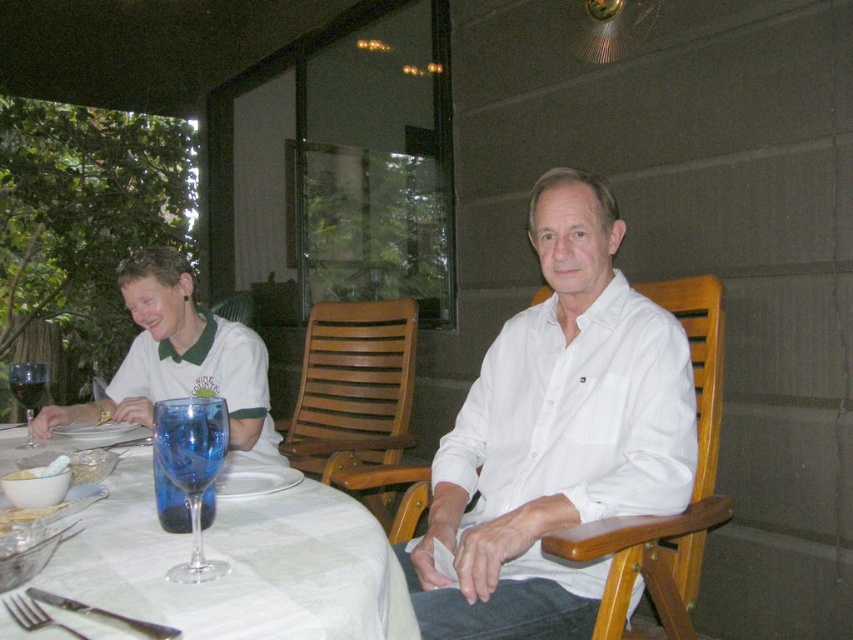
Can you confirm if white cotton shirt at upper center is thinner than white cotton shirt at center?

Yes.

Between white cotton shirt at upper center and white cotton shirt at center, which one appears on the right side from the viewer's perspective?

From the viewer's perspective, white cotton shirt at upper center appears more on the right side.

Is point (622, 355) less distant than point (579, 572)?

No.

This screenshot has width=853, height=640. I want to click on white cotton shirt at upper center, so click(556, 435).

Between light brown wooden chair at center and white cotton shirt at upper left, which one appears on the left side from the viewer's perspective?

white cotton shirt at upper left

Is light brown wooden chair at center thinner than white cotton shirt at upper left?

Correct, light brown wooden chair at center's width is less than white cotton shirt at upper left's.

At what (x,y) coordinates should I click in order to perform the action: click on light brown wooden chair at center. Please return your answer as a coordinate pair (x, y). This screenshot has height=640, width=853. Looking at the image, I should click on (357, 401).

Can you confirm if white cotton shirt at upper left is smaller than blue glass at table left?

No, white cotton shirt at upper left is not smaller than blue glass at table left.

Who is positioned more to the right, white cotton shirt at upper left or blue glass at table left?

blue glass at table left is more to the right.

Is point (149, 406) less distant than point (173, 422)?

No, (149, 406) is further to viewer.

Locate an element on the screen. The height and width of the screenshot is (640, 853). white cotton shirt at upper left is located at coordinates (206, 378).